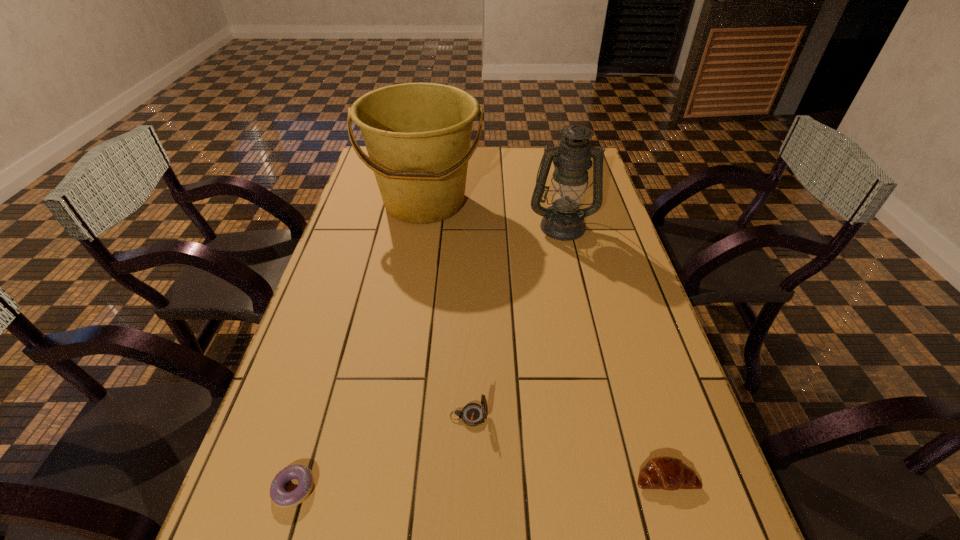
You are a GUI agent. You are given a task and a screenshot of the screen. Output one action in this format:
    pyautogui.click(x=<x>, y=<y>)
    Task: Click on the vacant region located on the back of the doughnut
    This screenshot has width=960, height=540.
    Given the screenshot: What is the action you would take?
    pyautogui.click(x=343, y=323)

Identify the location of object that is positioned at the far edge. (417, 135).

This screenshot has height=540, width=960. I want to click on bucket that is at the left edge, so click(417, 135).

You are a GUI agent. You are given a task and a screenshot of the screen. Output one action in this format:
    pyautogui.click(x=<x>, y=<y>)
    Task: Click on the doughnut located in the left edge section of the desktop
    The height and width of the screenshot is (540, 960).
    Given the screenshot: What is the action you would take?
    pyautogui.click(x=281, y=498)

Where is `oil lamp located at the right edge`? oil lamp located at the right edge is located at coordinates (563, 220).

Where is `crescent roll at the right edge`? The height and width of the screenshot is (540, 960). crescent roll at the right edge is located at coordinates (667, 473).

Where is `object situated at the far left corner`? The image size is (960, 540). object situated at the far left corner is located at coordinates (417, 135).

The height and width of the screenshot is (540, 960). What are the coordinates of `free space at the far edge of the desktop` in the screenshot? It's located at (486, 148).

Identify the location of blank space at the left edge. This screenshot has width=960, height=540. (310, 423).

Locate an element on the screen. free space at the right edge of the desktop is located at coordinates (655, 359).